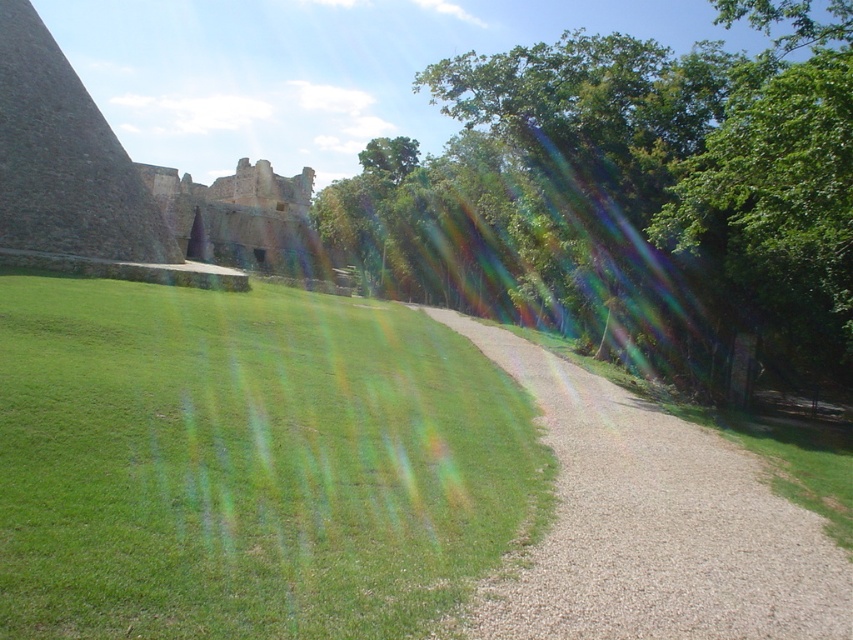
You are planning to set up a picnic area in the image. You have a picnic blanket that can cover an area the size of the green leafy tree at center. Can the green grassy at lower left accommodate the blanket?

The green grassy at lower left is smaller than the green leafy tree at center, so the area of the grassy spot is smaller than the picnic blanket. Therefore, the blanket cannot fit on the green grassy at lower left.

You are standing at the bottom right corner of the image and want to walk towards the green leafy tree at center. The green grassy at lower left is in your path. Since the grass is shorter than the tree, will you be able to see the tree clearly while walking through the grass?

The green grassy at lower left has a lesser height compared to green leafy tree at center. Yes, you will be able to see the green leafy tree at center clearly while walking through the grass since the grass is shorter and won

You are standing at the bottom of the image and want to walk towards the stone wall at upper left. Which direction should you turn to reach it without crossing the green grassy at lower left?

You should turn left to reach the stone wall at upper left without crossing the green grassy at lower left, as the green grassy at lower left is to the right of the stone wall at upper left.